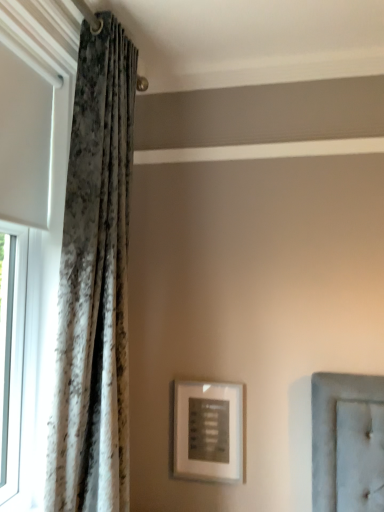
Find the location of a particular element. The width and height of the screenshot is (384, 512). velvet-like curtain at left is located at coordinates (95, 284).

Is matte silver picture frame at center next to white textured curtain at left?

No, matte silver picture frame at center is not beside white textured curtain at left.

How different are the orientations of matte silver picture frame at center and white textured curtain at left in degrees?

90.6 degrees separate the facing orientations of matte silver picture frame at center and white textured curtain at left.

Consider the image. Between matte silver picture frame at center and white textured curtain at left, which one appears on the left side from the viewer's perspective?

From the viewer's perspective, white textured curtain at left appears more on the left side.

Does point (235, 394) come farther from viewer compared to point (31, 206)?

Yes.

Which object is further away from the camera, matte silver picture frame at center or velvet-like curtain at left?

matte silver picture frame at center is behind.

Is matte silver picture frame at center oriented away from velvet-like curtain at left?

matte silver picture frame at center does not have its back to velvet-like curtain at left.

From the image's perspective, is matte silver picture frame at center above or below velvet-like curtain at left?

Based on their image positions, matte silver picture frame at center is located beneath velvet-like curtain at left.

There is a matte silver picture frame at center. At what (x,y) coordinates should I click in order to perform the action: click on curtain above it (from a real-world perspective). Please return your answer as a coordinate pair (x, y). Looking at the image, I should click on [95, 284].

Is point (38, 373) farther from viewer compared to point (192, 415)?

No, it is not.

From the image's perspective, is white textured curtain at left over matte silver picture frame at center?

Indeed, from the image's perspective, white textured curtain at left is shown above matte silver picture frame at center.

Find the location of a particular element. The image size is (384, 512). picture frame that appears below the white textured curtain at left (from the image's perspective) is located at coordinates (208, 431).

Considering the sizes of objects white textured curtain at left and velvet-like curtain at left in the image provided, who is thinner, white textured curtain at left or velvet-like curtain at left?

Thinner between the two is white textured curtain at left.

Is white textured curtain at left to the left of velvet-like curtain at left from the viewer's perspective?

Indeed, white textured curtain at left is positioned on the left side of velvet-like curtain at left.

Are white textured curtain at left and velvet-like curtain at left located far from each other?

That's not correct — white textured curtain at left is a little close to velvet-like curtain at left.

Between velvet-like curtain at left and matte silver picture frame at center, which one has smaller width?

matte silver picture frame at center.

Can you confirm if velvet-like curtain at left is shorter than matte silver picture frame at center?

No, velvet-like curtain at left is not shorter than matte silver picture frame at center.

Does velvet-like curtain at left have a larger size compared to matte silver picture frame at center?

Indeed, velvet-like curtain at left has a larger size compared to matte silver picture frame at center.

Is velvet-like curtain at left facing away from white textured curtain at left?

Correct, velvet-like curtain at left is looking away from white textured curtain at left.

Is velvet-like curtain at left positioned far away from white textured curtain at left?

That's not correct — velvet-like curtain at left is a little close to white textured curtain at left.

Does velvet-like curtain at left appear on the left side of white textured curtain at left?

In fact, velvet-like curtain at left is to the right of white textured curtain at left.

At what (x,y) coordinates should I click in order to perform the action: click on window on the left of matte silver picture frame at center. Please return your answer as a coordinate pair (x, y). Looking at the image, I should click on (x=37, y=194).

Locate an element on the screen. This screenshot has width=384, height=512. curtain above the matte silver picture frame at center (from the image's perspective) is located at coordinates (95, 284).

Considering their positions, is matte silver picture frame at center positioned further to velvet-like curtain at left than white textured curtain at left?

matte silver picture frame at center lies further to velvet-like curtain at left than the other object.

Which object lies further to the anchor point matte silver picture frame at center, white textured curtain at left or velvet-like curtain at left?

Among the two, white textured curtain at left is located further to matte silver picture frame at center.

Considering their positions, is velvet-like curtain at left positioned further to white textured curtain at left than matte silver picture frame at center?

matte silver picture frame at center is positioned further to the anchor white textured curtain at left.

Looking at this image, when comparing their distances from matte silver picture frame at center, does velvet-like curtain at left or white textured curtain at left seem closer?

Among the two, velvet-like curtain at left is located nearer to matte silver picture frame at center.

Which object lies nearer to the anchor point velvet-like curtain at left, white textured curtain at left or matte silver picture frame at center?

white textured curtain at left is closer to velvet-like curtain at left.

Which object lies further to the anchor point white textured curtain at left, matte silver picture frame at center or velvet-like curtain at left?

Among the two, matte silver picture frame at center is located further to white textured curtain at left.

Locate an element on the screen. This screenshot has height=512, width=384. curtain between white textured curtain at left and matte silver picture frame at center vertically is located at coordinates (95, 284).